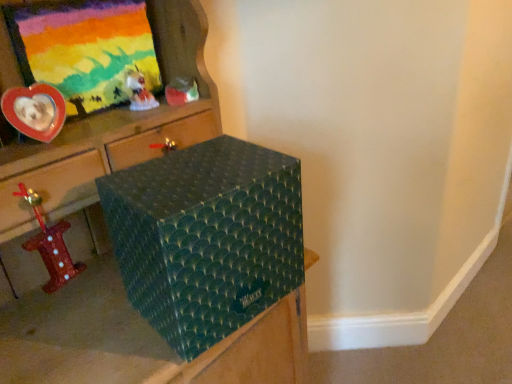
Question: Does metallic red number one at left, positioned as the third toy in right-to-left order, touch teal textured box at center?

Choices:
 (A) yes
 (B) no

Answer: (B)

Question: Considering the relative sizes of metallic red number one at left, which ranks as the 1th toy in bottom-to-top order, and teal textured box at center in the image provided, is metallic red number one at left, which ranks as the 1th toy in bottom-to-top order, thinner than teal textured box at center?

Choices:
 (A) no
 (B) yes

Answer: (B)

Question: Considering the relative sizes of metallic red number one at left, which is counted as the third toy, starting from the top, and teal textured box at center in the image provided, is metallic red number one at left, which is counted as the third toy, starting from the top, smaller than teal textured box at center?

Choices:
 (A) no
 (B) yes

Answer: (B)

Question: From the image's perspective, does metallic red number one at left, positioned as the third toy in right-to-left order, appear lower than teal textured box at center?

Choices:
 (A) no
 (B) yes

Answer: (B)

Question: Is metallic red number one at left, which is counted as the third toy, starting from the top, behind teal textured box at center?

Choices:
 (A) yes
 (B) no

Answer: (A)

Question: Is point (199, 332) closer or farther from the camera than point (53, 377)?

Choices:
 (A) closer
 (B) farther

Answer: (B)

Question: From a real-world perspective, is teal textured box at center positioned above or below green textured box at center?

Choices:
 (A) above
 (B) below

Answer: (A)

Question: In terms of height, does teal textured box at center look taller or shorter compared to green textured box at center?

Choices:
 (A) tall
 (B) short

Answer: (B)

Question: Is teal textured box at center in front of or behind green textured box at center in the image?

Choices:
 (A) front
 (B) behind

Answer: (B)

Question: Is teal textured box at center bigger or smaller than matte plastic picture frame at upper left?

Choices:
 (A) big
 (B) small

Answer: (A)

Question: From the image's perspective, relative to matte plastic picture frame at upper left, is teal textured box at center above or below?

Choices:
 (A) above
 (B) below

Answer: (B)

Question: Considering the positions of teal textured box at center and matte plastic picture frame at upper left in the image, is teal textured box at center taller or shorter than matte plastic picture frame at upper left?

Choices:
 (A) tall
 (B) short

Answer: (A)

Question: From a real-world perspective, relative to matte plastic picture frame at upper left, is teal textured box at center vertically above or below?

Choices:
 (A) below
 (B) above

Answer: (A)

Question: Based on their sizes in the image, would you say metallic red number one at left, which ranks as the 1th toy in bottom-to-top order, is bigger or smaller than matte plastic toy at upper center, positioned as the 3th toy in left-to-right order?

Choices:
 (A) small
 (B) big

Answer: (B)

Question: From their relative heights in the image, would you say metallic red number one at left, which is counted as the third toy, starting from the top, is taller or shorter than matte plastic toy at upper center, positioned as the 3th toy in left-to-right order?

Choices:
 (A) short
 (B) tall

Answer: (B)